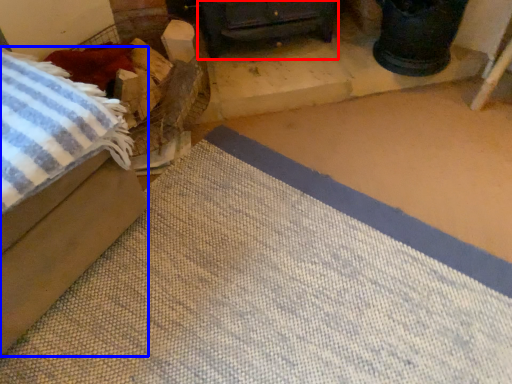
Question: Which object is closer to the camera taking this photo, furniture (highlighted by a red box) or furniture (highlighted by a blue box)?

Choices:
 (A) furniture
 (B) furniture

Answer: (B)